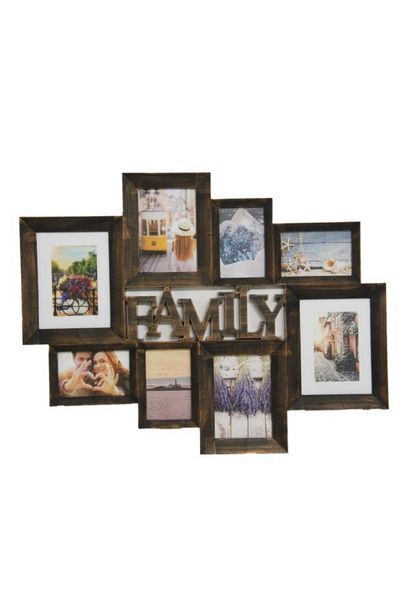
What are the coordinates of `frames` in the screenshot? It's located at (70, 279), (160, 231), (244, 242), (302, 253), (331, 343), (243, 397), (159, 387), (88, 378).